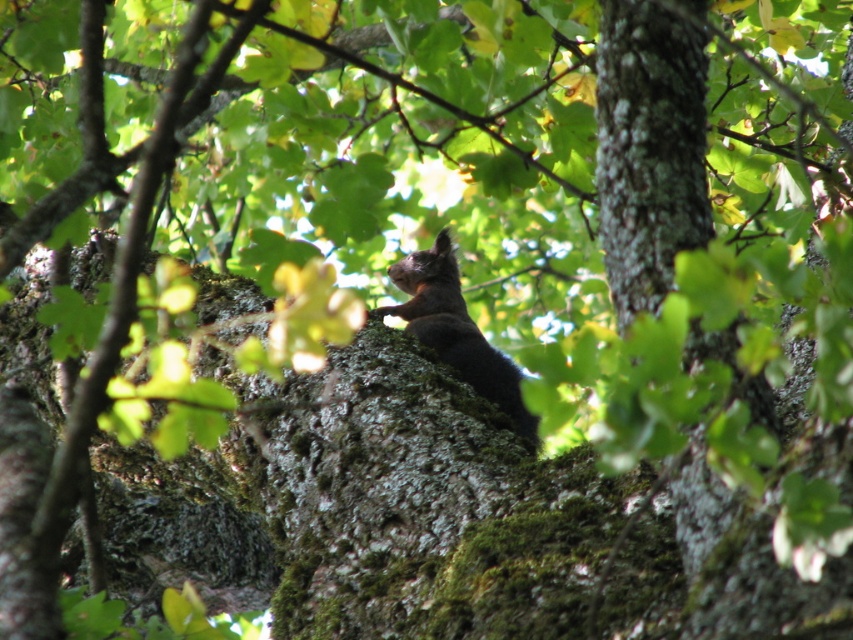
Question: Does green mossy bark at center have a lesser width compared to shiny brown fur at center?

Choices:
 (A) yes
 (B) no

Answer: (A)

Question: Which point is farther from the camera taking this photo?

Choices:
 (A) (438, 234)
 (B) (775, 429)

Answer: (A)

Question: Is green mossy bark at center above shiny brown fur at center?

Choices:
 (A) no
 (B) yes

Answer: (A)

Question: Which of the following is the closest to the observer?

Choices:
 (A) (680, 83)
 (B) (445, 244)

Answer: (A)

Question: Which object appears farthest from the camera in this image?

Choices:
 (A) green mossy bark at center
 (B) shiny brown fur at center

Answer: (B)

Question: Is green mossy bark at center closer to camera compared to shiny brown fur at center?

Choices:
 (A) yes
 (B) no

Answer: (A)